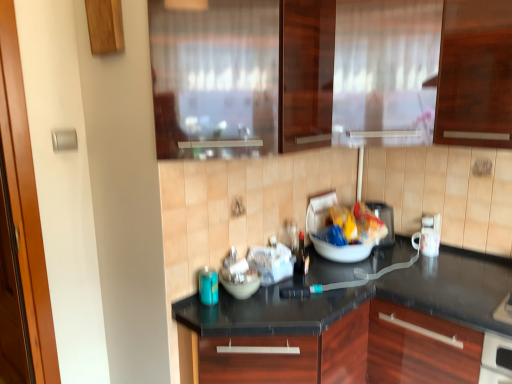
What are the coordinates of `blue glass bottle at lower left, which is the 3th appliance from back to front` in the screenshot? It's located at (208, 286).

Find the location of a particular element. The image size is (512, 384). frosted glass curtain at upper center is located at coordinates (386, 67).

What do you see at coordinates (358, 223) in the screenshot?
I see `matte plastic bag at center` at bounding box center [358, 223].

Describe the element at coordinates (241, 286) in the screenshot. I see `white glossy bowl at center` at that location.

Find the location of a particular element. black granite countertop at center is located at coordinates pos(356,327).

Where is `blue glass bottle at lower left, which is counted as the first appliance, starting from the front`? blue glass bottle at lower left, which is counted as the first appliance, starting from the front is located at coordinates 208,286.

In the image, is white glossy mug at right, the second appliance in the back-to-front sequence, on the left side or the right side of white glossy bowl at center?

From the image, it's evident that white glossy mug at right, the second appliance in the back-to-front sequence, is to the right of white glossy bowl at center.

From a real-world perspective, which object stands above the other?

From a 3D spatial view, white glossy mug at right, which appears as the third appliance when viewed from the left, is above.

Is white glossy mug at right, the first appliance when ordered from right to left, behind white glossy bowl at center?

Yes, the depth of white glossy mug at right, the first appliance when ordered from right to left, is greater than that of white glossy bowl at center.

Which is behind, point (432, 251) or point (232, 291)?

The point (432, 251) is farther.

In the scene shown: Considering their positions, is black granite countertop at center located in front of or behind matte plastic bag at center?

Clearly, black granite countertop at center is in front of matte plastic bag at center.

Where is `countertop that appears below the matte plastic bag at center (from the image's perspective)`? The image size is (512, 384). countertop that appears below the matte plastic bag at center (from the image's perspective) is located at coordinates (356, 327).

From a real-world perspective, which is physically above, black granite countertop at center or matte plastic bag at center?

matte plastic bag at center is physically above.

Considering the sizes of black granite countertop at center and matte plastic bag at center in the image, is black granite countertop at center bigger or smaller than matte plastic bag at center?

black granite countertop at center is bigger than matte plastic bag at center.

From the picture: Are matte plastic toaster at center, the 3th appliance in the front-to-back sequence, and white glossy mug at right, which appears as the third appliance when viewed from the left, far apart?

No, matte plastic toaster at center, the 3th appliance in the front-to-back sequence, is not far away from white glossy mug at right, which appears as the third appliance when viewed from the left.

Does matte plastic toaster at center, the 3th appliance in the front-to-back sequence, have a larger size compared to white glossy mug at right, the first appliance when ordered from right to left?

Correct, matte plastic toaster at center, the 3th appliance in the front-to-back sequence, is larger in size than white glossy mug at right, the first appliance when ordered from right to left.

Which object is wider, matte plastic toaster at center, arranged as the 1th appliance when viewed from the back, or white glossy mug at right, which appears as the third appliance when viewed from the left?

With larger width is matte plastic toaster at center, arranged as the 1th appliance when viewed from the back.

Is matte plastic toaster at center, arranged as the 1th appliance when viewed from the back, looking in the opposite direction of white glossy mug at right, which is the 2th appliance in front-to-back order?

No, white glossy mug at right, which is the 2th appliance in front-to-back order, is not at the back of matte plastic toaster at center, arranged as the 1th appliance when viewed from the back.

Considering the relative positions of transparent glass window at upper center and white glossy mug at right, the second appliance in the back-to-front sequence, in the image provided, is transparent glass window at upper center to the left or to the right of white glossy mug at right, the second appliance in the back-to-front sequence,?

transparent glass window at upper center is positioned on white glossy mug at right, the second appliance in the back-to-front sequence,'s left side.

Between transparent glass window at upper center and white glossy mug at right, the second appliance in the back-to-front sequence, which one has smaller width?

white glossy mug at right, the second appliance in the back-to-front sequence, is thinner.

Is transparent glass window at upper center facing away from white glossy mug at right, which appears as the third appliance when viewed from the left?

No, transparent glass window at upper center's orientation is not away from white glossy mug at right, which appears as the third appliance when viewed from the left.

Find the location of a particular element. The width and height of the screenshot is (512, 384). window lying in front of the white glossy mug at right, which appears as the third appliance when viewed from the left is located at coordinates (215, 79).

Is black granite countertop at center completely or partially inside matte plastic bag at center?

No, black granite countertop at center is not inside matte plastic bag at center.

Would you consider matte plastic bag at center to be distant from black granite countertop at center?

No, matte plastic bag at center is not far from black granite countertop at center.

Looking at this image, does matte plastic bag at center come behind black granite countertop at center?

Yes, it is.

Can you tell me how much matte plastic bag at center and blue glass bottle at lower left, which is counted as the first appliance, starting from the front, differ in facing direction?

The angular difference between matte plastic bag at center and blue glass bottle at lower left, which is counted as the first appliance, starting from the front, is 139 degrees.

Would you say matte plastic bag at center is inside or outside blue glass bottle at lower left, which is counted as the first appliance, starting from the front?

matte plastic bag at center is not enclosed by blue glass bottle at lower left, which is counted as the first appliance, starting from the front.

Which object is wider, matte plastic bag at center or blue glass bottle at lower left, the first appliance positioned from the left?

matte plastic bag at center.

From a real-world perspective, is matte plastic bag at center located beneath blue glass bottle at lower left, which is counted as the 3th appliance, starting from the right?

Actually, matte plastic bag at center is physically above blue glass bottle at lower left, which is counted as the 3th appliance, starting from the right, in the real world.

Considering the sizes of black granite countertop at center and frosted glass curtain at upper center in the image, is black granite countertop at center wider or thinner than frosted glass curtain at upper center?

black granite countertop at center is wider than frosted glass curtain at upper center.

Considering the points (352, 371) and (393, 90), which point is behind, point (352, 371) or point (393, 90)?

Point (352, 371)

Is black granite countertop at center closer to camera compared to frosted glass curtain at upper center?

Yes.

Which of these two, black granite countertop at center or frosted glass curtain at upper center, is smaller?

frosted glass curtain at upper center.

The height and width of the screenshot is (384, 512). I want to click on bowl below the white glossy mug at right, which appears as the third appliance when viewed from the left (from the image's perspective), so click(x=241, y=286).

Where is `countertop located on the left of matte plastic bag at center`? The height and width of the screenshot is (384, 512). countertop located on the left of matte plastic bag at center is located at coordinates point(356,327).

When comparing their distances from white glossy bowl at center, does black granite countertop at center or transparent glass window at upper center seem closer?

black granite countertop at center is closer to white glossy bowl at center.

Based on their spatial positions, is white glossy mug at right, the first appliance when ordered from right to left, or black granite countertop at center further from frosted glass curtain at upper center?

black granite countertop at center.

Estimate the real-world distances between objects in this image. Which object is closer to frosted glass curtain at upper center, black granite countertop at center or white glossy mug at right, which appears as the third appliance when viewed from the left?

The object closer to frosted glass curtain at upper center is white glossy mug at right, which appears as the third appliance when viewed from the left.

Based on their spatial positions, is blue glass bottle at lower left, which is the 3th appliance from back to front, or transparent glass window at upper center further from white glossy mug at right, which is the 2th appliance in front-to-back order?

Among the two, transparent glass window at upper center is located further to white glossy mug at right, which is the 2th appliance in front-to-back order.

Considering their positions, is frosted glass curtain at upper center positioned further to white glossy mug at right, which is the 2th appliance in front-to-back order, than blue glass bottle at lower left, which is the 3th appliance from back to front?

blue glass bottle at lower left, which is the 3th appliance from back to front, lies further to white glossy mug at right, which is the 2th appliance in front-to-back order, than the other object.

Estimate the real-world distances between objects in this image. Which object is further from transparent glass window at upper center, frosted glass curtain at upper center or matte plastic toaster at center, arranged as the 1th appliance when viewed from the back?

Among the two, matte plastic toaster at center, arranged as the 1th appliance when viewed from the back, is located further to transparent glass window at upper center.

Which object lies nearer to the anchor point white glossy mug at right, the second appliance in the back-to-front sequence, matte plastic bag at center or frosted glass curtain at upper center?

matte plastic bag at center lies closer to white glossy mug at right, the second appliance in the back-to-front sequence, than the other object.

Based on their spatial positions, is frosted glass curtain at upper center or white glossy mug at right, which is the 2th appliance in front-to-back order, closer to black granite countertop at center?

white glossy mug at right, which is the 2th appliance in front-to-back order, is closer to black granite countertop at center.

Where is `food between blue glass bottle at lower left, which is counted as the first appliance, starting from the front, and white glossy mug at right, which appears as the third appliance when viewed from the left, in the horizontal direction`? This screenshot has width=512, height=384. food between blue glass bottle at lower left, which is counted as the first appliance, starting from the front, and white glossy mug at right, which appears as the third appliance when viewed from the left, in the horizontal direction is located at coordinates (358, 223).

I want to click on bowl between transparent glass window at upper center and matte plastic toaster at center, the 3th appliance in the front-to-back sequence, in the front-back direction, so click(x=241, y=286).

Where is `food between transparent glass window at upper center and white glossy bowl at center in the up-down direction`? This screenshot has height=384, width=512. food between transparent glass window at upper center and white glossy bowl at center in the up-down direction is located at coordinates (358, 223).

This screenshot has width=512, height=384. Find the location of `food between white glossy bowl at center and matte plastic toaster at center, which ranks as the 2th appliance in left-to-right order, in the horizontal direction`. food between white glossy bowl at center and matte plastic toaster at center, which ranks as the 2th appliance in left-to-right order, in the horizontal direction is located at coordinates (358, 223).